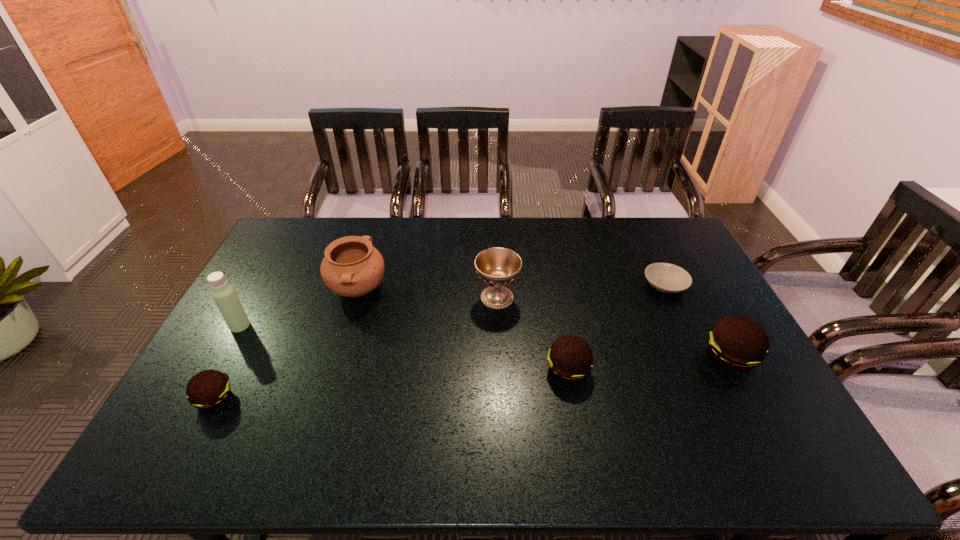
Locate an element on the screen. Image resolution: width=960 pixels, height=540 pixels. free area in between the chalice and the tallest patty is located at coordinates (613, 327).

At what (x,y) coordinates should I click in order to perform the action: click on empty location between the second shortest object and the fifth object from right to left. Please return your answer as a coordinate pair (x, y). The image size is (960, 540). Looking at the image, I should click on (286, 344).

Image resolution: width=960 pixels, height=540 pixels. Identify the location of unoccupied area between the fourth farthest object and the fifth object from right to left. (299, 308).

Find the location of a particular element. The width and height of the screenshot is (960, 540). blank region between the fifth tallest object and the chalice is located at coordinates (533, 333).

Where is `free space between the thermos bottle and the chalice`? Image resolution: width=960 pixels, height=540 pixels. free space between the thermos bottle and the chalice is located at coordinates (369, 311).

This screenshot has width=960, height=540. What are the coordinates of `free space between the third shortest object and the shortest object` in the screenshot? It's located at (616, 328).

This screenshot has width=960, height=540. In order to click on vacant space in between the tallest patty and the third object from right to left in this screenshot , I will do point(649,363).

Identify the location of empty location between the fourth shortest object and the tallest object. This screenshot has height=540, width=960. (485, 341).

Identify the location of free point between the shortest object and the chalice. (581, 292).

You are a GUI agent. You are given a task and a screenshot of the screen. Output one action in this format:
    pyautogui.click(x=<x>, y=<y>)
    Task: Click on the sixth closest object to the tallest patty
    This screenshot has width=960, height=540.
    Given the screenshot: What is the action you would take?
    tap(223, 293)